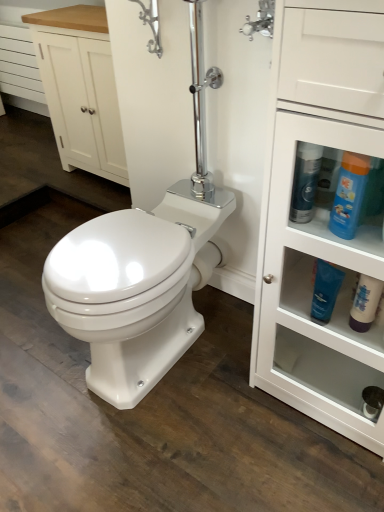
Question: Is blue glossy bottle at right, which is counted as the 1th cleaning product, starting from the left, in front of or behind blue plastic bottle at upper right, the second cleaning product when ordered from right to left, in the image?

Choices:
 (A) front
 (B) behind

Answer: (B)

Question: From the image's perspective, relative to blue plastic bottle at upper right, which is the 3th cleaning product in left-to-right order, is blue glossy bottle at right, which is counted as the fourth cleaning product, starting from the right, above or below?

Choices:
 (A) above
 (B) below

Answer: (A)

Question: Considering the real-world distances, which object is closest to the blue plastic bottle at upper right, which is the 3th cleaning product in left-to-right order?

Choices:
 (A) white matte bottle at lower right, which is the first cleaning product from right to left
 (B) blue glossy bottle at right, which is counted as the fourth cleaning product, starting from the right
 (C) white wood drawer at upper left
 (D) white glossy cabinet at right
 (E) blue glossy tube at lower right, acting as the 2th cleaning product starting from the left

Answer: (B)

Question: Estimate the real-world distances between objects in this image. Which object is farther from the blue glossy bottle at right, which is counted as the fourth cleaning product, starting from the right?

Choices:
 (A) blue plastic bottle at upper right, which is the 3th cleaning product in left-to-right order
 (B) white glossy cabinet at right
 (C) white wood cabinet at upper left
 (D) white wood drawer at upper left
 (E) white matte bottle at lower right, which is the first cleaning product from right to left

Answer: (D)